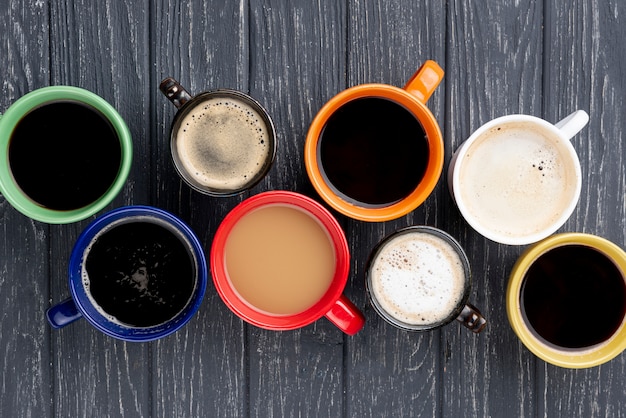
In order to click on mug handle in this screenshot , I will do `click(61, 310)`, `click(173, 89)`, `click(347, 315)`, `click(429, 76)`, `click(476, 313)`, `click(573, 126)`.